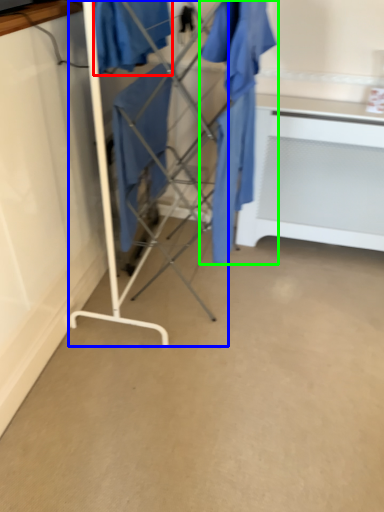
Question: Which object is the closest to the clothing (highlighted by a red box)? Choose among these: furniture (highlighted by a blue box) or clothing (highlighted by a green box).

Choices:
 (A) furniture
 (B) clothing

Answer: (A)